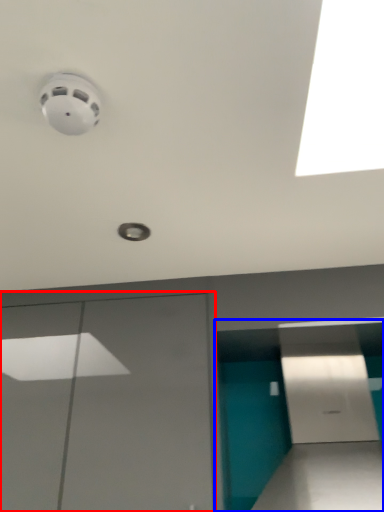
Question: Which object is closer to the camera taking this photo, garage door (highlighted by a red box) or parking garage (highlighted by a blue box)?

Choices:
 (A) garage door
 (B) parking garage

Answer: (B)